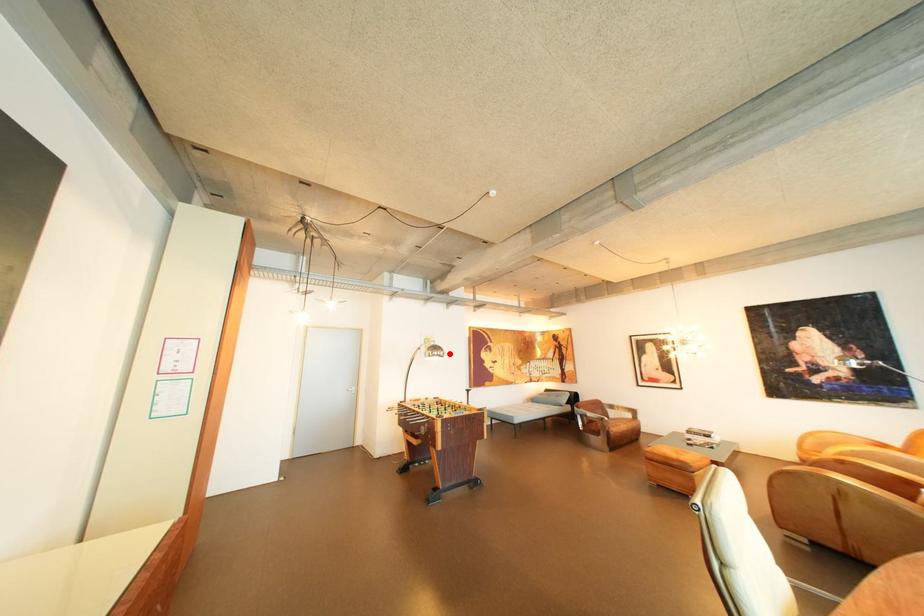
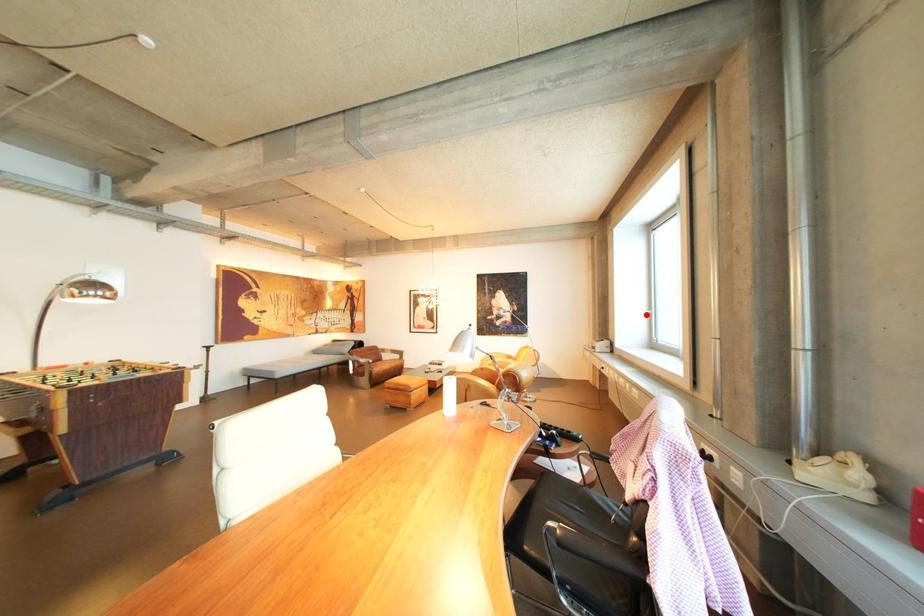
I am providing you with two images of the same scene from different viewpoints. A red point is marked on the first image and another point is marked on the second image. Do the highlighted points in image1 and image2 indicate the same real-world spot?

No